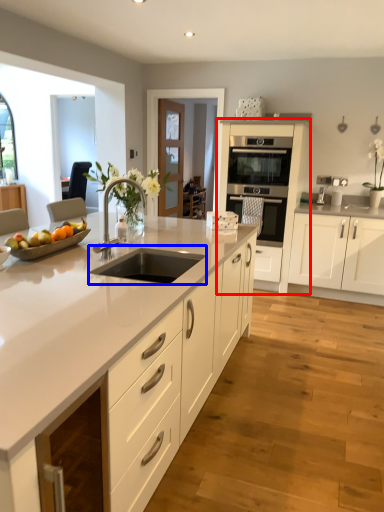
Question: Which object appears closest to the camera in this image, cabinetry (highlighted by a red box) or sink (highlighted by a blue box)?

Choices:
 (A) cabinetry
 (B) sink

Answer: (B)